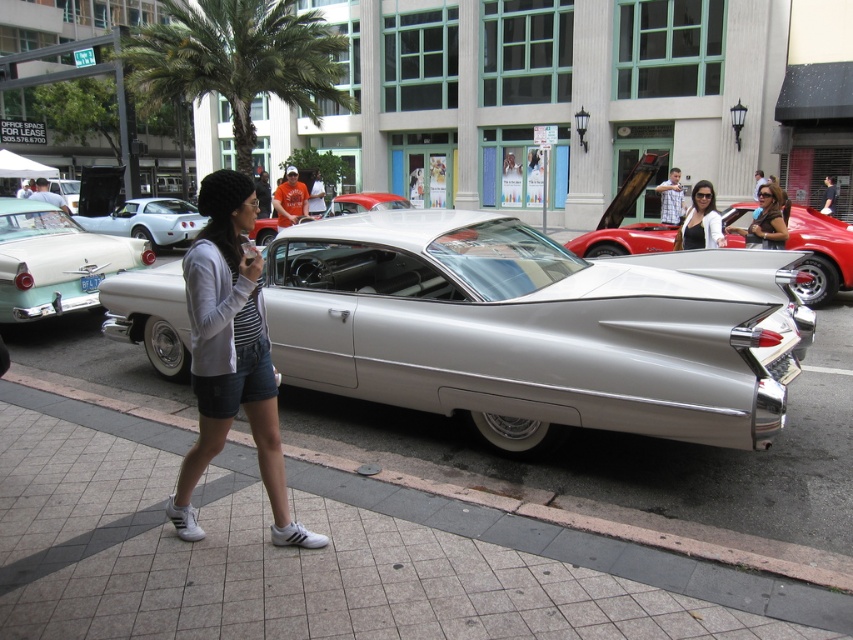
Question: Is shiny white car at center further to the viewer compared to matte black dress at center?

Choices:
 (A) yes
 (B) no

Answer: (A)

Question: Which of the following is the closest to the observer?

Choices:
 (A) (183, 16)
 (B) (366, 195)
 (C) (122, 214)

Answer: (B)

Question: In this image, where is shiny white car at center located relative to shiny silver car at center?

Choices:
 (A) left
 (B) right

Answer: (A)

Question: Which point is closer to the camera taking this photo?

Choices:
 (A) (245, 144)
 (B) (120, 234)

Answer: (B)

Question: Which object is the closest to the denim shorts at center?

Choices:
 (A) matte brown leather jacket at center
 (B) shiny white car at center
 (C) gray tile pavement at lower center
 (D) white glossy car at left

Answer: (C)

Question: Does green leafy palm tree at upper center appear on the left side of shiny white car at center?

Choices:
 (A) yes
 (B) no

Answer: (B)